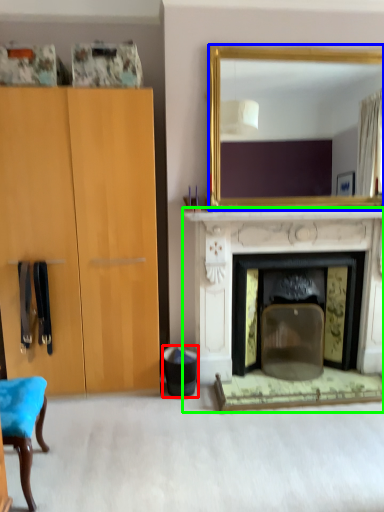
Question: Considering the real-world distances, which object is farthest from trash bin/can (highlighted by a red box)? mirror (highlighted by a blue box) or fireplace (highlighted by a green box)?

Choices:
 (A) mirror
 (B) fireplace

Answer: (A)